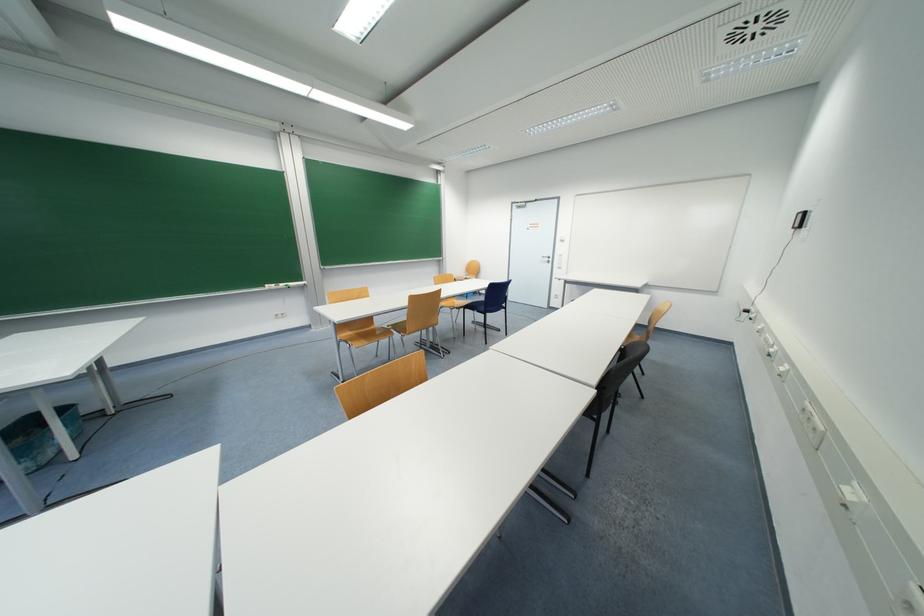
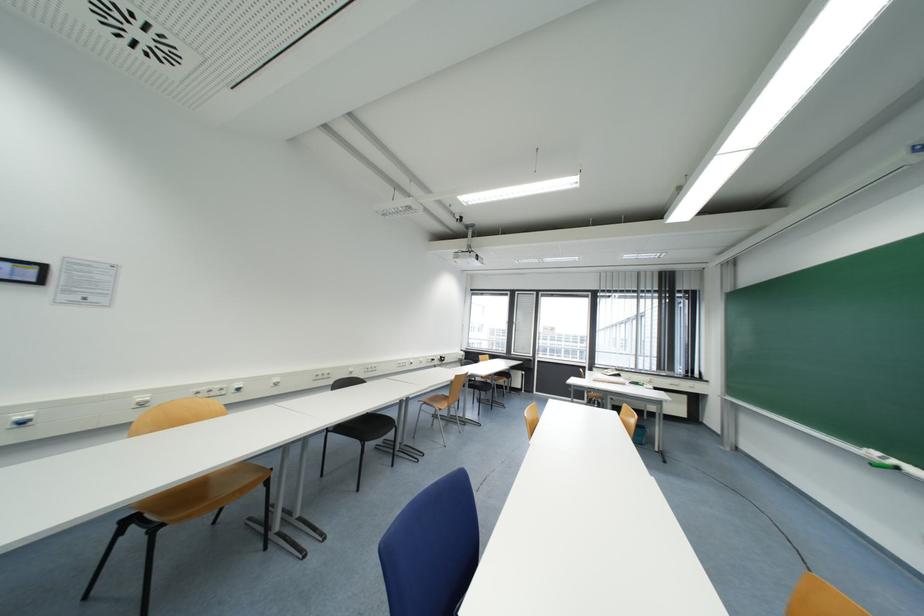
Question: I am providing you with two images of the same scene from different viewpoints. Which of the following objects are not visible in image2?

Choices:
 (A) wooden chair sitting surface
 (B) kettle power switch
 (C) brown chair sitting surface
 (D) green chalkboard eraser

Answer: (A)